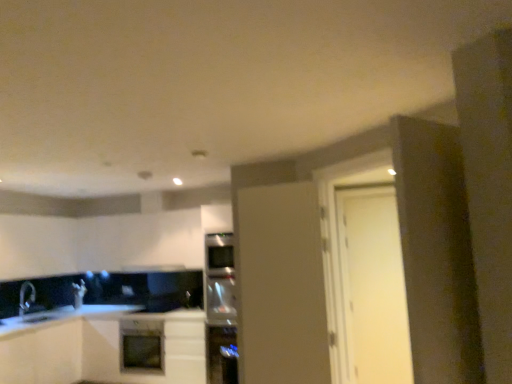
Describe the element at coordinates (220, 309) in the screenshot. I see `sleek stainless steel refrigerator at center, marked as the 1th appliance in a top-to-bottom arrangement` at that location.

Describe the element at coordinates (221, 354) in the screenshot. This screenshot has height=384, width=512. I see `sleek metallic fridge at center, the second appliance when ordered from top to bottom` at that location.

Looking at this image, measure the distance between matte white door at center, which is counted as the 2th door, starting from the back, and camera.

A distance of 3.12 meters exists between matte white door at center, which is counted as the 2th door, starting from the back, and camera.

What do you see at coordinates (280, 285) in the screenshot? I see `matte white door at center, acting as the first door starting from the left` at bounding box center [280, 285].

You are a GUI agent. You are given a task and a screenshot of the screen. Output one action in this format:
    pyautogui.click(x=<x>, y=<y>)
    Task: Click on the sleek stainless steel refrigerator at center, marked as the 1th appliance in a top-to-bottom arrangement
    Image resolution: width=512 pixels, height=384 pixels.
    Given the screenshot: What is the action you would take?
    pyautogui.click(x=220, y=309)

Which point is more forward, (14,363) or (212,366)?

The point (14,363) is in front.

Who is bigger, white matte cabinet at lower left, which is counted as the second cabinetry, starting from the right, or sleek metallic fridge at center, the first appliance in the bottom-to-top sequence?

Bigger between the two is white matte cabinet at lower left, which is counted as the second cabinetry, starting from the right.

From the picture: How many degrees apart are the facing directions of white matte cabinet at lower left, the first cabinetry viewed from the left, and sleek metallic fridge at center, the first appliance in the bottom-to-top sequence?

The angular difference between white matte cabinet at lower left, the first cabinetry viewed from the left, and sleek metallic fridge at center, the first appliance in the bottom-to-top sequence, is 90 degrees.

Is white matte cabinet at lower left, the first cabinetry viewed from the left, far from sleek metallic fridge at center, the second appliance when ordered from top to bottom?

That's right, there is a large distance between white matte cabinet at lower left, the first cabinetry viewed from the left, and sleek metallic fridge at center, the second appliance when ordered from top to bottom.

From the picture: Would you say white matte door at right, arranged as the 1th door when viewed from the back, is to the left or to the right of black matte exhaust hood at center in the picture?

Based on their positions, white matte door at right, arranged as the 1th door when viewed from the back, is located to the right of black matte exhaust hood at center.

Which is correct: white matte door at right, the first door in the right-to-left sequence, is inside black matte exhaust hood at center, or outside of it?

white matte door at right, the first door in the right-to-left sequence, is not enclosed by black matte exhaust hood at center.

Do you think sleek metallic fridge at center, the first appliance in the bottom-to-top sequence, is within matte white door at center, acting as the first door starting from the left, or outside of it?

sleek metallic fridge at center, the first appliance in the bottom-to-top sequence, is located beyond the bounds of matte white door at center, acting as the first door starting from the left.

From the picture: In terms of height, does sleek metallic fridge at center, the second appliance when ordered from top to bottom, look taller or shorter compared to matte white door at center, the second door from the right?

Considering their sizes, sleek metallic fridge at center, the second appliance when ordered from top to bottom, has less height than matte white door at center, the second door from the right.

Is matte white door at center, acting as the first door starting from the left, at the back of sleek metallic fridge at center, the first appliance in the bottom-to-top sequence?

No.

Which is closer, [218,349] or [267,281]?

Point [218,349].

Which of these two, white matte cabinet at center, marked as the second cabinetry in a left-to-right arrangement, or white matte door at right, which ranks as the second door in left-to-right order, stands shorter?

With less height is white matte cabinet at center, marked as the second cabinetry in a left-to-right arrangement.

Does white matte cabinet at center, positioned as the 1th cabinetry in right-to-left order, have a lesser width compared to white matte door at right, which ranks as the second door in left-to-right order?

In fact, white matte cabinet at center, positioned as the 1th cabinetry in right-to-left order, might be wider than white matte door at right, which ranks as the second door in left-to-right order.

Is white matte cabinet at center, marked as the second cabinetry in a left-to-right arrangement, inside the boundaries of white matte door at right, which ranks as the second door in left-to-right order, or outside?

white matte cabinet at center, marked as the second cabinetry in a left-to-right arrangement, is outside white matte door at right, which ranks as the second door in left-to-right order.

Is sleek stainless steel refrigerator at center, marked as the 1th appliance in a top-to-bottom arrangement, facing towards white matte door at right, the first door in the right-to-left sequence?

No, sleek stainless steel refrigerator at center, marked as the 1th appliance in a top-to-bottom arrangement, is not turned towards white matte door at right, the first door in the right-to-left sequence.

In the scene shown: Would you say sleek stainless steel refrigerator at center, the second appliance positioned from the bottom, is to the left or to the right of white matte door at right, the first door in the right-to-left sequence, in the picture?

sleek stainless steel refrigerator at center, the second appliance positioned from the bottom, is to the left of white matte door at right, the first door in the right-to-left sequence.

Can white matte door at right, the first door in the right-to-left sequence, be found inside sleek stainless steel refrigerator at center, marked as the 1th appliance in a top-to-bottom arrangement?

No, white matte door at right, the first door in the right-to-left sequence, is not a part of sleek stainless steel refrigerator at center, marked as the 1th appliance in a top-to-bottom arrangement.

Is matte white oven at center not close to white matte door at right, marked as the second door in a front-to-back arrangement?

Indeed, matte white oven at center is not near white matte door at right, marked as the second door in a front-to-back arrangement.

Is matte white oven at center inside the boundaries of white matte door at right, arranged as the 1th door when viewed from the back, or outside?

matte white oven at center is not inside white matte door at right, arranged as the 1th door when viewed from the back, it's outside.

Between matte white oven at center and white matte door at right, the first door in the right-to-left sequence, which one has smaller width?

white matte door at right, the first door in the right-to-left sequence, is thinner.

Considering the positions of point (121, 340) and point (390, 340), is point (121, 340) closer or farther from the camera than point (390, 340)?

Point (121, 340) is farther from the camera than point (390, 340).

Is white matte cabinet at center, marked as the second cabinetry in a left-to-right arrangement, further to camera compared to matte white door at center, acting as the first door starting from the left?

Yes.

In the scene shown: Considering the sizes of objects white matte cabinet at center, marked as the second cabinetry in a left-to-right arrangement, and matte white door at center, which is counted as the 2th door, starting from the back, in the image provided, who is smaller, white matte cabinet at center, marked as the second cabinetry in a left-to-right arrangement, or matte white door at center, which is counted as the 2th door, starting from the back,?

matte white door at center, which is counted as the 2th door, starting from the back.

Which is correct: white matte cabinet at center, positioned as the 1th cabinetry in right-to-left order, is inside matte white door at center, the second door from the right, or outside of it?

white matte cabinet at center, positioned as the 1th cabinetry in right-to-left order, is not enclosed by matte white door at center, the second door from the right.

Is white matte cabinet at center, marked as the second cabinetry in a left-to-right arrangement, shorter than matte white door at center, acting as the first door starting from the left?

Yes.

Find the location of a particular element. The width and height of the screenshot is (512, 384). the 2nd cabinetry below when counting from the sleek metallic fridge at center, the first appliance in the bottom-to-top sequence (from the image's perspective) is located at coordinates coord(42,354).

Where is `exhaust hood above the white matte door at right, marked as the second door in a front-to-back arrangement (from a real-world perspective)`? This screenshot has height=384, width=512. exhaust hood above the white matte door at right, marked as the second door in a front-to-back arrangement (from a real-world perspective) is located at coordinates (153, 268).

Estimate the real-world distances between objects in this image. Which object is further from sleek metallic fridge at center, the first appliance in the bottom-to-top sequence, white matte cabinet at lower left, which is counted as the second cabinetry, starting from the right, or matte white door at center, positioned as the 1th door in front-to-back order?

Among the two, white matte cabinet at lower left, which is counted as the second cabinetry, starting from the right, is located further to sleek metallic fridge at center, the first appliance in the bottom-to-top sequence.

Looking at the image, which one is located further to sleek metallic fridge at center, the second appliance when ordered from top to bottom, matte white door at center, positioned as the 1th door in front-to-back order, or matte white oven at center?

matte white door at center, positioned as the 1th door in front-to-back order.

From the image, which object appears to be nearer to white matte cabinet at center, marked as the second cabinetry in a left-to-right arrangement, matte white door at center, acting as the first door starting from the left, or white matte cabinet at lower left, which is counted as the second cabinetry, starting from the right?

white matte cabinet at lower left, which is counted as the second cabinetry, starting from the right, is closer to white matte cabinet at center, marked as the second cabinetry in a left-to-right arrangement.

Which object lies nearer to the anchor point matte white oven at center, black matte exhaust hood at center or matte white door at center, the second door from the right?

The object closer to matte white oven at center is black matte exhaust hood at center.

Looking at the image, which one is located further to white matte cabinet at lower left, the first cabinetry viewed from the left, sleek stainless steel refrigerator at center, marked as the 1th appliance in a top-to-bottom arrangement, or black matte exhaust hood at center?

Based on the image, sleek stainless steel refrigerator at center, marked as the 1th appliance in a top-to-bottom arrangement, appears to be further to white matte cabinet at lower left, the first cabinetry viewed from the left.

Considering their positions, is matte white door at center, positioned as the 1th door in front-to-back order, positioned closer to white matte door at right, which ranks as the second door in left-to-right order, than white matte cabinet at center, marked as the second cabinetry in a left-to-right arrangement?

matte white door at center, positioned as the 1th door in front-to-back order.

From the image, which object appears to be nearer to white matte cabinet at lower left, the first cabinetry viewed from the left, white matte cabinet at center, marked as the second cabinetry in a left-to-right arrangement, or sleek stainless steel refrigerator at center, marked as the 1th appliance in a top-to-bottom arrangement?

The object closer to white matte cabinet at lower left, the first cabinetry viewed from the left, is white matte cabinet at center, marked as the second cabinetry in a left-to-right arrangement.

Looking at the image, which one is located further to white matte cabinet at center, positioned as the 1th cabinetry in right-to-left order, white matte cabinet at lower left, the first cabinetry viewed from the left, or matte white door at center, which is counted as the 2th door, starting from the back?

Based on the image, matte white door at center, which is counted as the 2th door, starting from the back, appears to be further to white matte cabinet at center, positioned as the 1th cabinetry in right-to-left order.

What are the coordinates of `cabinetry between white matte cabinet at lower left, which is counted as the second cabinetry, starting from the right, and matte white door at center, positioned as the 1th door in front-to-back order` in the screenshot? It's located at (99, 348).

I want to click on appliance between white matte cabinet at center, positioned as the 1th cabinetry in right-to-left order, and sleek metallic fridge at center, the first appliance in the bottom-to-top sequence, from left to right, so click(x=220, y=309).

Find the location of a particular element. cabinetry between white matte cabinet at lower left, the first cabinetry viewed from the left, and matte white oven at center from left to right is located at coordinates (99, 348).

The width and height of the screenshot is (512, 384). In order to click on appliance between matte white door at center, which is counted as the 2th door, starting from the back, and sleek stainless steel refrigerator at center, the second appliance positioned from the bottom, in the front-back direction in this screenshot , I will do `click(221, 354)`.